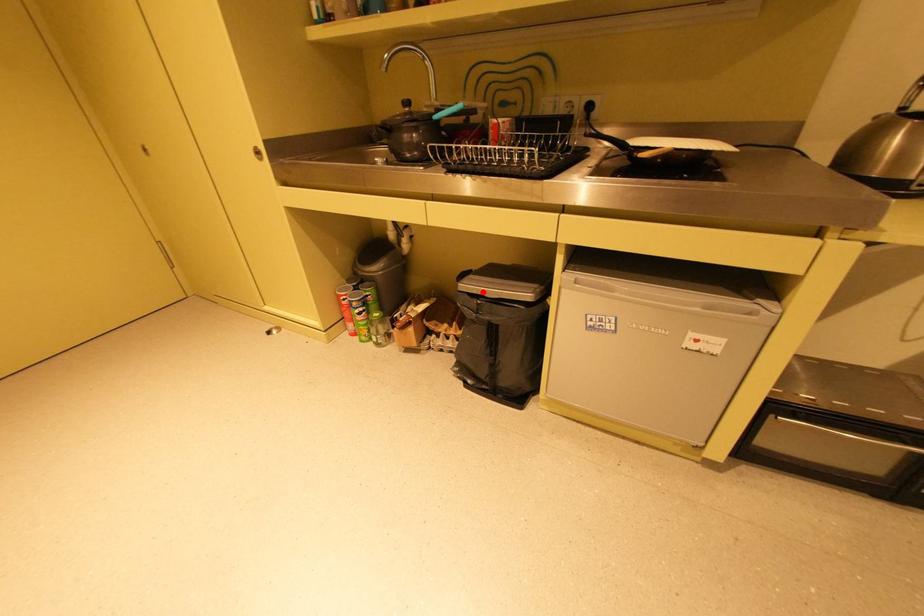
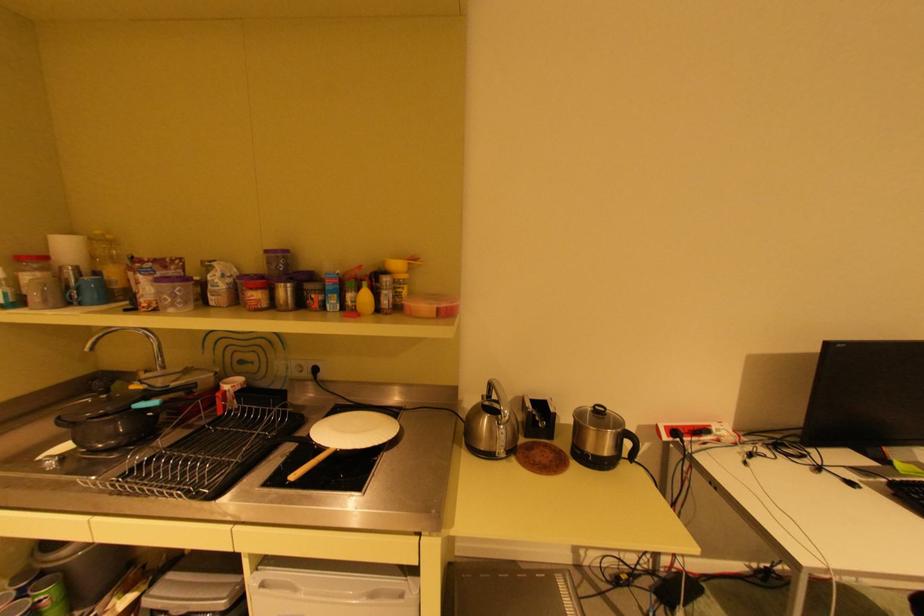
Question: I am providing you with two images of the same scene from different viewpoints. In image1, a red point is highlighted. Considering the same 3D point in image2, which of the following is correct?

Choices:
 (A) It is closer
 (B) It is farther

Answer: (A)